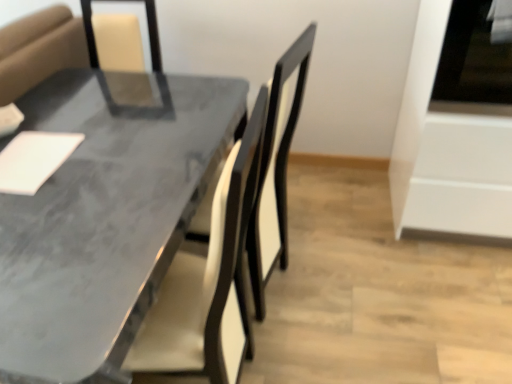
Question: From a real-world perspective, is marble gray table at center above or below white glossy oven at right?

Choices:
 (A) below
 (B) above

Answer: (A)

Question: Is marble gray table at center bigger or smaller than white glossy oven at right?

Choices:
 (A) small
 (B) big

Answer: (B)

Question: Relative to white glossy oven at right, is marble gray table at center in front or behind?

Choices:
 (A) behind
 (B) front

Answer: (B)

Question: From the image's perspective, is white glossy oven at right above or below marble gray table at center?

Choices:
 (A) below
 (B) above

Answer: (B)

Question: Looking at the image, does white glossy oven at right seem bigger or smaller compared to marble gray table at center?

Choices:
 (A) small
 (B) big

Answer: (A)

Question: In the image, is white glossy oven at right positioned in front of or behind marble gray table at center?

Choices:
 (A) front
 (B) behind

Answer: (B)

Question: Looking at their shapes, would you say white glossy oven at right is wider or thinner than marble gray table at center?

Choices:
 (A) thin
 (B) wide

Answer: (A)